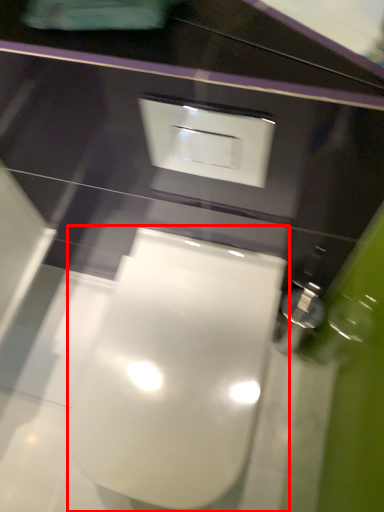
Question: From the image's perspective, what is the correct spatial relationship of toilet (annotated by the red box) in relation to square?

Choices:
 (A) below
 (B) above

Answer: (A)